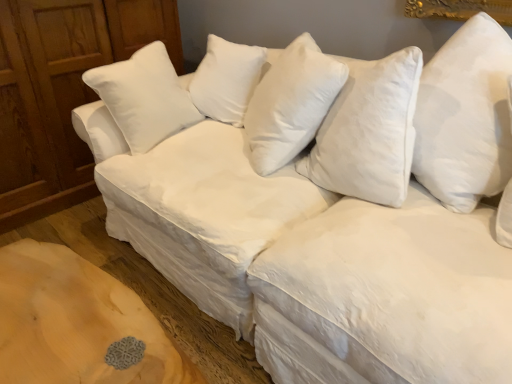
Find the location of a particular element. Image resolution: width=512 pixels, height=384 pixels. white soft pillow at upper right, acting as the first pillow starting from the front is located at coordinates point(465,116).

Is white soft pillow at center, the 1th pillow from the left, oriented towards wooden dresser at left?

No, white soft pillow at center, the 1th pillow from the left, is not oriented towards wooden dresser at left.

Which of these two, white soft pillow at center, the 1th pillow from the left, or wooden dresser at left, stands shorter?

Standing shorter between the two is white soft pillow at center, the 1th pillow from the left.

From a real-world perspective, does white soft pillow at center, the second pillow when ordered from right to left, sit lower than wooden dresser at left?

No, from a real-world perspective, white soft pillow at center, the second pillow when ordered from right to left, is not beneath wooden dresser at left.

Is white soft pillow at center, the 1th pillow positioned from the back, spatially inside wooden dresser at left, or outside of it?

white soft pillow at center, the 1th pillow positioned from the back, is not inside wooden dresser at left, it's outside.

Locate an element on the screen. The height and width of the screenshot is (384, 512). the 2nd pillow to the right of the wooden dresser at left, counting from the anchor's position is located at coordinates (465, 116).

What's the angular difference between wooden dresser at left and white soft pillow at upper right, the second pillow positioned from the back,'s facing directions?

The angular difference between wooden dresser at left and white soft pillow at upper right, the second pillow positioned from the back, is 59.7 degrees.

Which object is closer to the camera taking this photo, wooden dresser at left or white soft pillow at upper right, acting as the first pillow starting from the front?

white soft pillow at upper right, acting as the first pillow starting from the front.

How distant is white soft pillow at upper right, which is counted as the 2th pillow, starting from the left, from white soft pillow at center, the second pillow when ordered from right to left?

white soft pillow at upper right, which is counted as the 2th pillow, starting from the left, is 17.99 inches from white soft pillow at center, the second pillow when ordered from right to left.

From the image's perspective, would you say white soft pillow at upper right, marked as the 1th pillow in a right-to-left arrangement, is positioned over white soft pillow at center, the 1th pillow positioned from the back?

No, from the image's perspective, white soft pillow at upper right, marked as the 1th pillow in a right-to-left arrangement, is not above white soft pillow at center, the 1th pillow positioned from the back.

Does point (476, 72) come in front of point (298, 143)?

Yes, it is in front of point (298, 143).

Which of these two, white soft pillow at upper right, acting as the first pillow starting from the front, or white soft pillow at center, the 1th pillow from the left, stands shorter?

Standing shorter between the two is white soft pillow at center, the 1th pillow from the left.

How far apart are wooden dresser at left and white soft pillow at center, the second pillow when ordered from right to left?

A distance of 1.04 meters exists between wooden dresser at left and white soft pillow at center, the second pillow when ordered from right to left.

Which is correct: wooden dresser at left is inside white soft pillow at center, the 1th pillow positioned from the back, or outside of it?

wooden dresser at left is not inside white soft pillow at center, the 1th pillow positioned from the back, it's outside.

Could you tell me if wooden dresser at left is turned towards white soft pillow at center, the 1th pillow positioned from the back?

Yes, wooden dresser at left is oriented towards white soft pillow at center, the 1th pillow positioned from the back.

Which of these two, wooden dresser at left or white soft pillow at center, the second pillow when ordered from right to left, is thinner?

Thinner between the two is white soft pillow at center, the second pillow when ordered from right to left.

The width and height of the screenshot is (512, 384). Identify the location of pillow below the white soft pillow at center, the 1th pillow positioned from the back (from the image's perspective). 465,116.

Is white soft pillow at center, the 2th pillow viewed from the front, positioned with its back to white soft pillow at upper right, acting as the first pillow starting from the front?

white soft pillow at center, the 2th pillow viewed from the front, does not have its back to white soft pillow at upper right, acting as the first pillow starting from the front.

Which is in front, white soft pillow at center, the 2th pillow viewed from the front, or white soft pillow at upper right, the second pillow positioned from the back?

white soft pillow at upper right, the second pillow positioned from the back, is in front.

Does white soft pillow at center, the 1th pillow positioned from the back, have a larger size compared to white soft pillow at upper right, the second pillow positioned from the back?

Correct, white soft pillow at center, the 1th pillow positioned from the back, is larger in size than white soft pillow at upper right, the second pillow positioned from the back.

Can you confirm if white soft pillow at upper right, the second pillow positioned from the back, is positioned to the left of wooden dresser at left?

Incorrect, white soft pillow at upper right, the second pillow positioned from the back, is not on the left side of wooden dresser at left.

Is white soft pillow at upper right, acting as the first pillow starting from the front, looking in the opposite direction of wooden dresser at left?

white soft pillow at upper right, acting as the first pillow starting from the front, is not turned away from wooden dresser at left.

From a real-world perspective, which is physically below, white soft pillow at upper right, the second pillow positioned from the back, or wooden dresser at left?

From a 3D spatial view, wooden dresser at left is below.

From the image's perspective, which one is positioned higher, white soft pillow at upper right, the second pillow positioned from the back, or wooden dresser at left?

wooden dresser at left appears higher in the image.

You are a GUI agent. You are given a task and a screenshot of the screen. Output one action in this format:
    pyautogui.click(x=<x>, y=<y>)
    Task: Click on the dresser above the white soft pillow at center, the 2th pillow viewed from the front (from the image's perspective)
    The image size is (512, 384).
    Given the screenshot: What is the action you would take?
    pyautogui.click(x=61, y=92)

Find the location of a particular element. This screenshot has width=512, height=384. the 2nd pillow below the wooden dresser at left (from the image's perspective) is located at coordinates (465, 116).

Considering their positions, is wooden dresser at left positioned closer to white soft pillow at upper right, which is counted as the 2th pillow, starting from the left, than white soft pillow at center, the 1th pillow positioned from the back?

Based on the image, white soft pillow at center, the 1th pillow positioned from the back, appears to be nearer to white soft pillow at upper right, which is counted as the 2th pillow, starting from the left.

Estimate the real-world distances between objects in this image. Which object is further from white soft pillow at center, the 2th pillow viewed from the front, wooden dresser at left or white soft pillow at upper right, marked as the 1th pillow in a right-to-left arrangement?

Among the two, wooden dresser at left is located further to white soft pillow at center, the 2th pillow viewed from the front.

When comparing their distances from wooden dresser at left, does white soft pillow at upper right, acting as the first pillow starting from the front, or white soft pillow at center, the 2th pillow viewed from the front, seem further?

Based on the image, white soft pillow at upper right, acting as the first pillow starting from the front, appears to be further to wooden dresser at left.

Considering their positions, is white soft pillow at center, the second pillow when ordered from right to left, positioned further to wooden dresser at left than white soft pillow at upper right, acting as the first pillow starting from the front?

Based on the image, white soft pillow at upper right, acting as the first pillow starting from the front, appears to be further to wooden dresser at left.

From the image, which object appears to be farther from white soft pillow at center, the second pillow when ordered from right to left, white soft pillow at upper right, which is counted as the 2th pillow, starting from the left, or wooden dresser at left?

wooden dresser at left.

Which object lies nearer to the anchor point white soft pillow at upper right, marked as the 1th pillow in a right-to-left arrangement, white soft pillow at center, the 1th pillow from the left, or wooden dresser at left?

white soft pillow at center, the 1th pillow from the left, is closer to white soft pillow at upper right, marked as the 1th pillow in a right-to-left arrangement.

Locate an element on the screen. The height and width of the screenshot is (384, 512). pillow situated between wooden dresser at left and white soft pillow at upper right, marked as the 1th pillow in a right-to-left arrangement, from left to right is located at coordinates (290, 104).